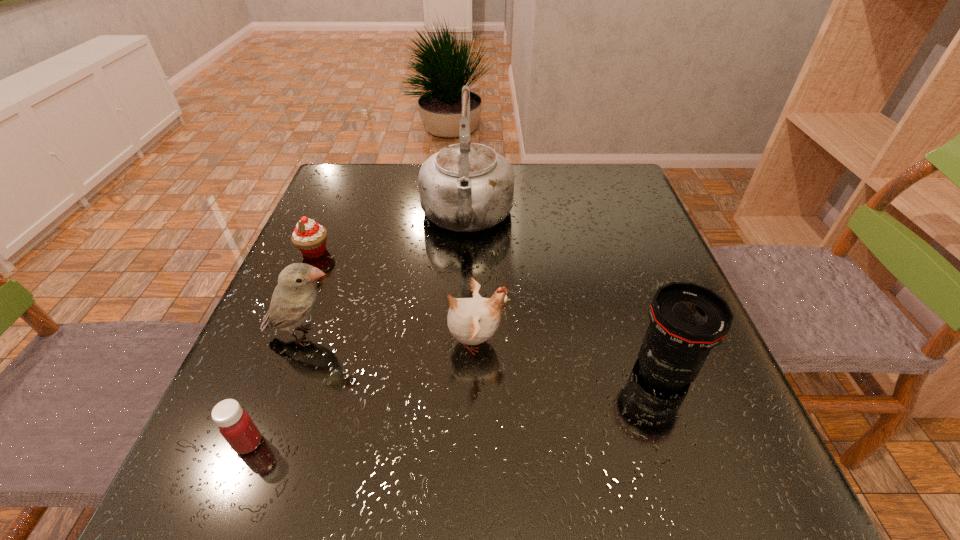
This screenshot has width=960, height=540. I want to click on vacant space at the near edge of the desktop, so click(429, 489).

You are a GUI agent. You are given a task and a screenshot of the screen. Output one action in this format:
    pyautogui.click(x=<x>, y=<y>)
    Task: Click on the vacant space at the left edge of the desktop
    
    Given the screenshot: What is the action you would take?
    pyautogui.click(x=345, y=230)

You are a GUI agent. You are given a task and a screenshot of the screen. Output one action in this format:
    pyautogui.click(x=<x>, y=<y>)
    Task: Click on the vacant space at the right edge of the desktop
    The height and width of the screenshot is (540, 960).
    Given the screenshot: What is the action you would take?
    pyautogui.click(x=593, y=230)

What are the coordinates of `free space at the far left corner` in the screenshot? It's located at (378, 166).

This screenshot has width=960, height=540. Identify the location of vacant space at the near right corner of the desktop. (782, 509).

You are a GUI agent. You are given a task and a screenshot of the screen. Output one action in this format:
    pyautogui.click(x=<x>, y=<y>)
    Task: Click on the empty space that is in between the tallest object and the rightmost object
    
    Given the screenshot: What is the action you would take?
    pyautogui.click(x=565, y=293)

Locate an element on the screen. The width and height of the screenshot is (960, 540). empty space that is in between the kettle and the cupcake is located at coordinates (391, 234).

Where is `free area in between the taller bird and the kettle`? free area in between the taller bird and the kettle is located at coordinates (386, 276).

Identify the location of free point between the taller bird and the telephoto lens. Image resolution: width=960 pixels, height=540 pixels. (485, 352).

Find the location of a particular element. This screenshot has height=540, width=960. vacant region between the cupcake and the shorter bird is located at coordinates (395, 296).